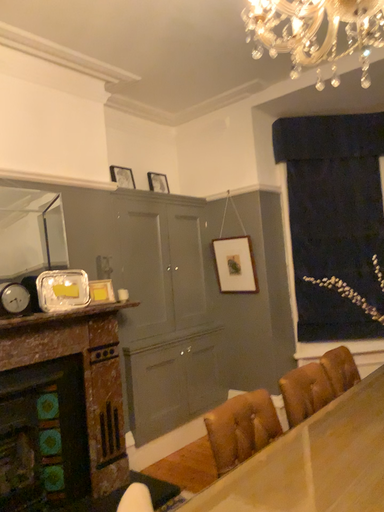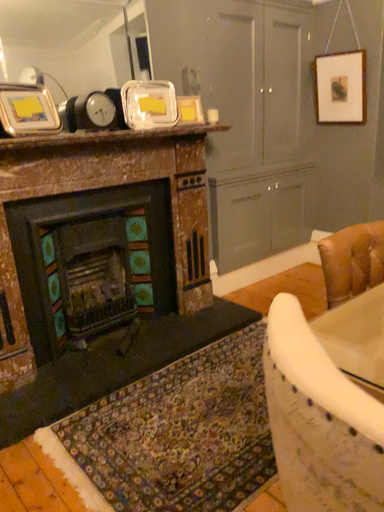
Question: How did the camera likely rotate when shooting the video?

Choices:
 (A) rotated upward
 (B) rotated downward

Answer: (B)